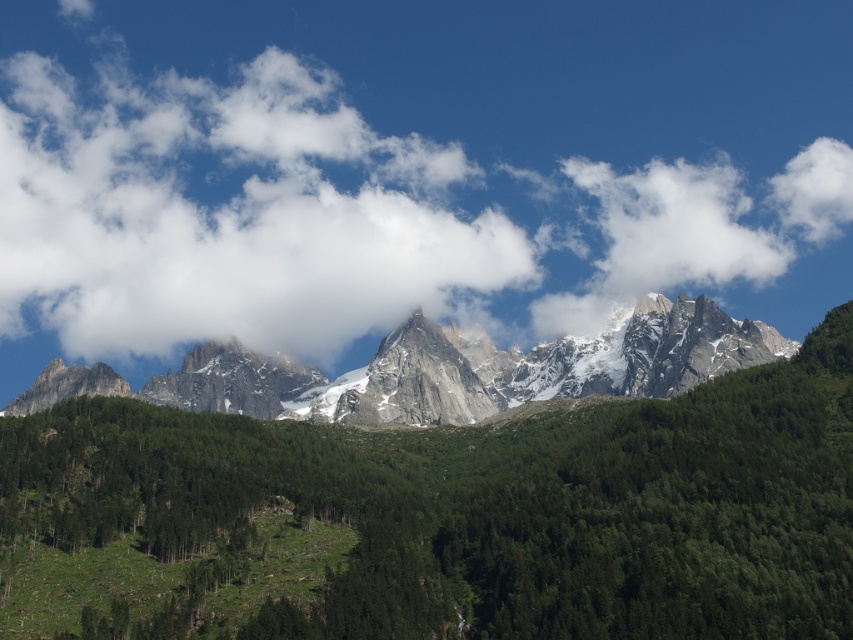
Question: Which point is farther from the camera taking this photo?

Choices:
 (A) (827, 196)
 (B) (318, 628)
 (C) (410, 417)

Answer: (A)

Question: Does white fluffy cloud at upper center appear under green matte tree at center?

Choices:
 (A) yes
 (B) no

Answer: (B)

Question: Can you confirm if green matte tree at center is thinner than snowy granite mountain range at center?

Choices:
 (A) yes
 (B) no

Answer: (A)

Question: Can you confirm if green matte tree at center is wider than snowy granite mountain range at center?

Choices:
 (A) yes
 (B) no

Answer: (B)

Question: Which point is farther to the camera?

Choices:
 (A) (164, 385)
 (B) (296, 128)
 (C) (245, 529)

Answer: (B)

Question: Among these objects, which one is farthest from the camera?

Choices:
 (A) white fluffy cloud at upper center
 (B) green matte tree at center
 (C) snowy granite mountain range at center

Answer: (A)